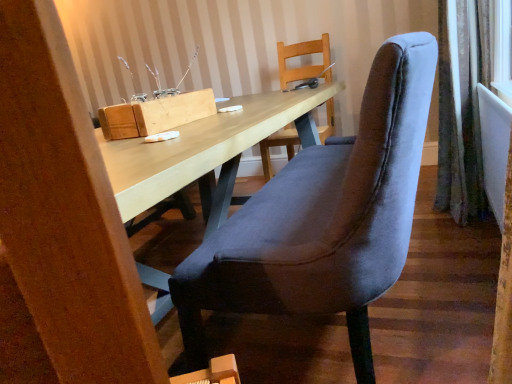
Question: From the image's perspective, relative to wooden block at upper center, is velvet curtain at right above or below?

Choices:
 (A) above
 (B) below

Answer: (A)

Question: Is velvet curtain at right taller or shorter than wooden block at upper center?

Choices:
 (A) short
 (B) tall

Answer: (B)

Question: Considering the real-world distances, which object is closest to the velvet blue chair at center?

Choices:
 (A) velvet curtain at right
 (B) wooden block at upper center

Answer: (B)

Question: Based on their relative distances, which object is farther from the wooden block at upper center?

Choices:
 (A) velvet blue chair at center
 (B) velvet curtain at right

Answer: (B)